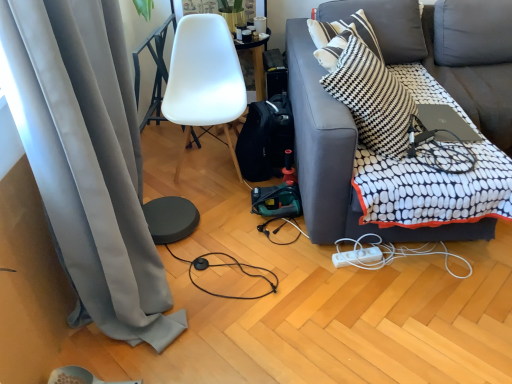
Where is `empty space that is in between white plastic power strip at lower right and black cable at lower center`? empty space that is in between white plastic power strip at lower right and black cable at lower center is located at coordinates (323, 275).